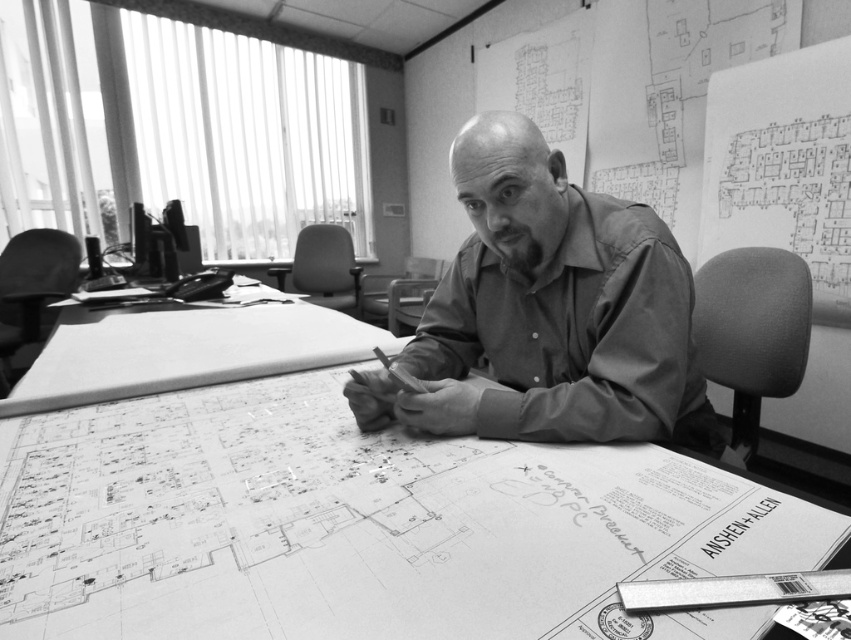
Does point (347, 504) lie behind point (585, 282)?

That is False.

Is white paper at center wider than smooth shirt at center?

Indeed, white paper at center has a greater width compared to smooth shirt at center.

Between point (220, 445) and point (375, 419), which one is positioned in front?

Point (220, 445) is in front.

The width and height of the screenshot is (851, 640). I want to click on white paper at center, so click(x=361, y=525).